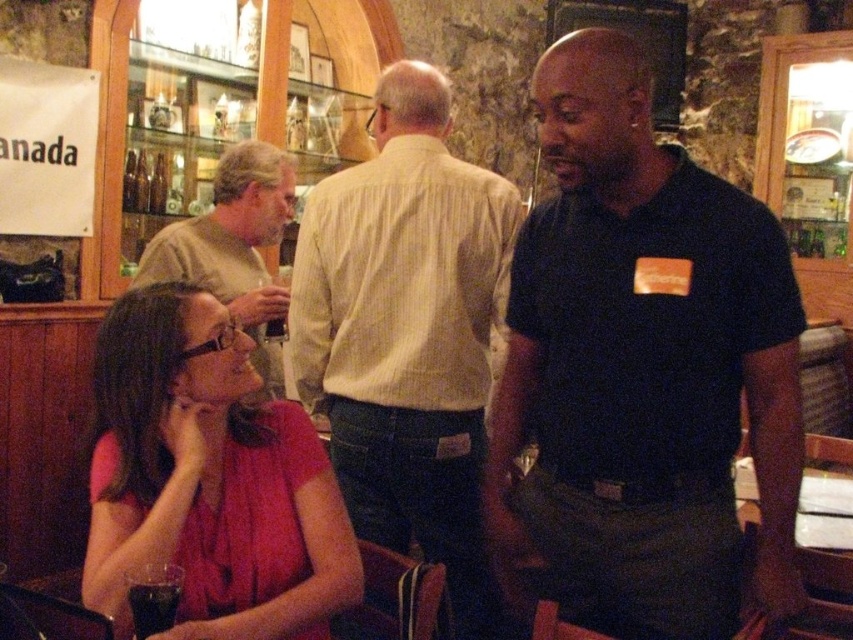
Question: Which of these objects is positioned closest to the matte pink blouse at lower left?

Choices:
 (A) light brown shirt at upper left
 (B) black cotton shirt at center
 (C) light beige striped shirt at center

Answer: (B)

Question: Does black cotton shirt at center lie in front of light beige striped shirt at center?

Choices:
 (A) yes
 (B) no

Answer: (A)

Question: Is black cotton shirt at center in front of light brown shirt at upper left?

Choices:
 (A) no
 (B) yes

Answer: (B)

Question: Can you confirm if black cotton shirt at center is smaller than light beige striped shirt at center?

Choices:
 (A) yes
 (B) no

Answer: (A)

Question: Among these objects, which one is nearest to the camera?

Choices:
 (A) light beige striped shirt at center
 (B) dark brown liquid at lower left
 (C) black cotton shirt at center
 (D) light brown shirt at upper left

Answer: (B)

Question: Which of the following is the closest to the observer?

Choices:
 (A) light brown shirt at upper left
 (B) black cotton shirt at center
 (C) light beige striped shirt at center
 (D) dark brown liquid at lower left

Answer: (D)